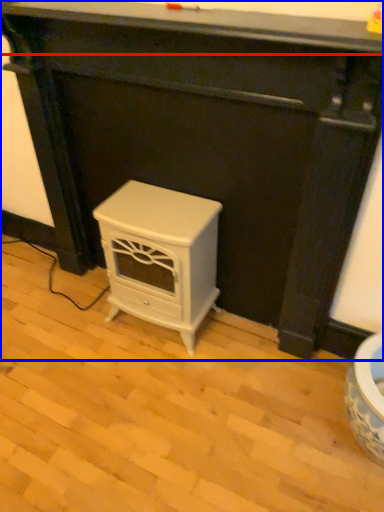
Question: Which point is further to the camera, counter top (highlighted by a red box) or furniture (highlighted by a blue box)?

Choices:
 (A) counter top
 (B) furniture

Answer: (B)